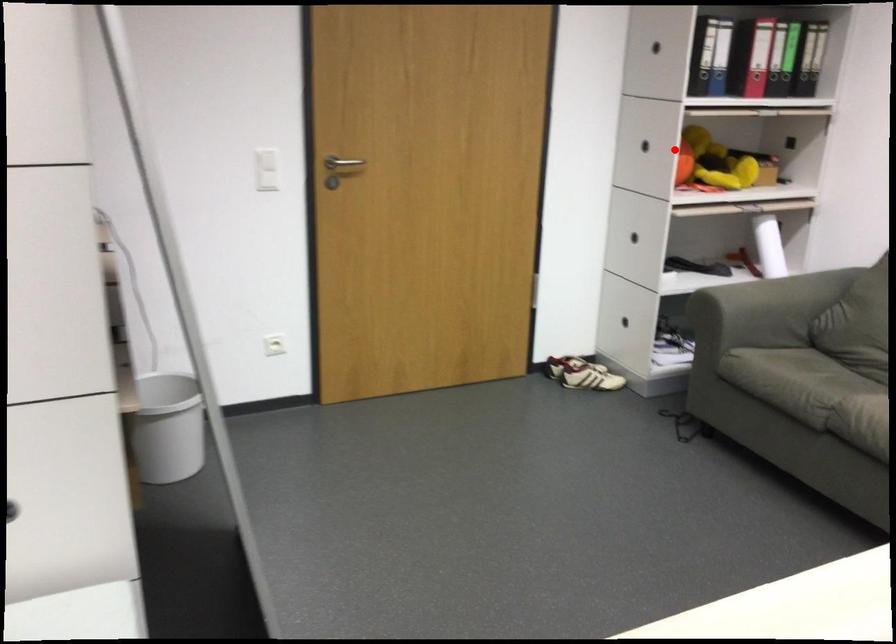
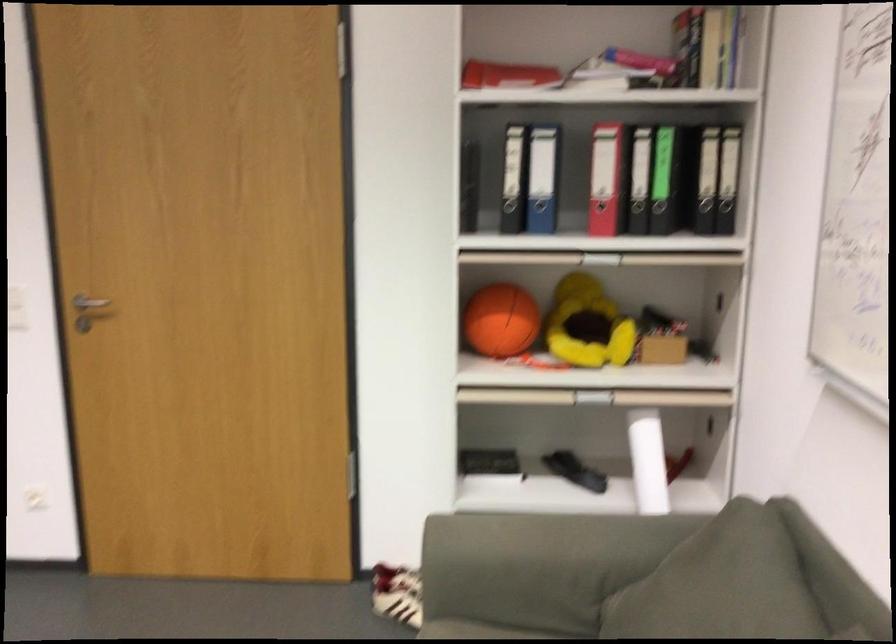
Question: I am providing you with two images of the same scene from different viewpoints. Given a red point in image1, look at the same physical point in image2. Is it:

Choices:
 (A) Closer to the viewpoint
 (B) Farther from the viewpoint

Answer: (A)